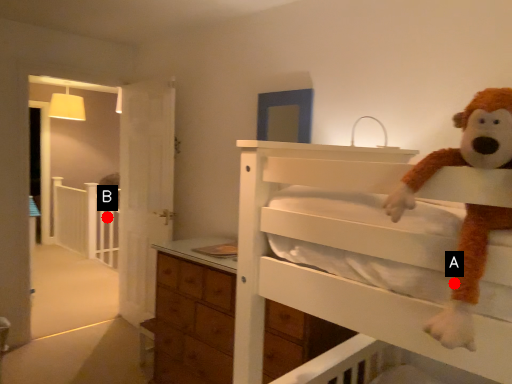
Question: Two points are circled on the image, labeled by A and B beside each circle. Which of the following is the closest to the observer?

Choices:
 (A) A is closer
 (B) B is closer

Answer: (A)